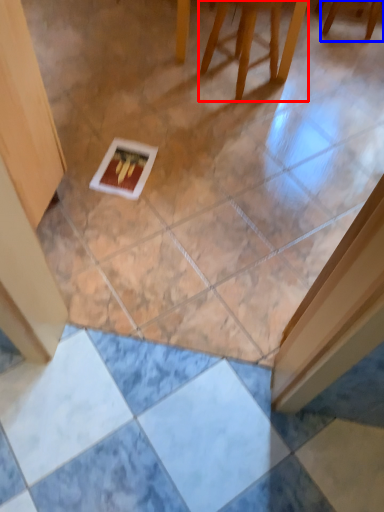
Question: Which object is further to the camera taking this photo, furniture (highlighted by a red box) or furniture (highlighted by a blue box)?

Choices:
 (A) furniture
 (B) furniture

Answer: (B)